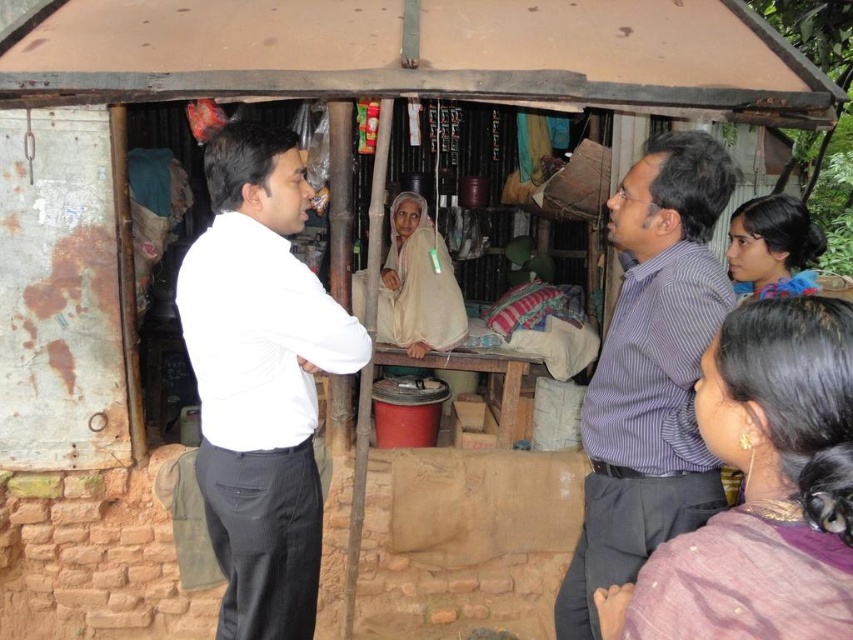
You are organizing a clothing donation drive and need to sort shirts by size. You have a white smooth shirt at left and a striped cotton shirt at center. Which shirt should you place in the large size bin?

The white smooth shirt at left is larger in size than the striped cotton shirt at center, so it should be placed in the large size bin.